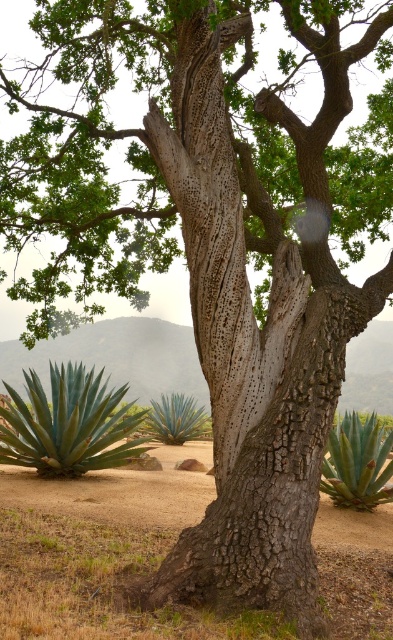
You are standing in front of the tree and want to reach the green succulent at center. However, there is a green succulent at lower right in your path. Can you walk directly to the center succulent without stepping on the lower right one?

The green succulent at lower right is in front of the green succulent at center, so you would have to step over or around it to reach the center one.

You are standing at the base of the tree and want to water both the green succulent at lower right and the green succulent at center. If your watering can has a range of 5 meters, can you reach both plants without moving?

The green succulent at lower right is 7.32 meters away from the green succulent at center. Since your watering can only reaches 5 meters, you cannot water both plants without moving because the distance between them exceeds the watering can range.

You are standing in a garden and see the brown dirt field at center and the green succulent at center. Which object is located to the left of the other?

The brown dirt field at center is positioned on the left side of green succulent at center.